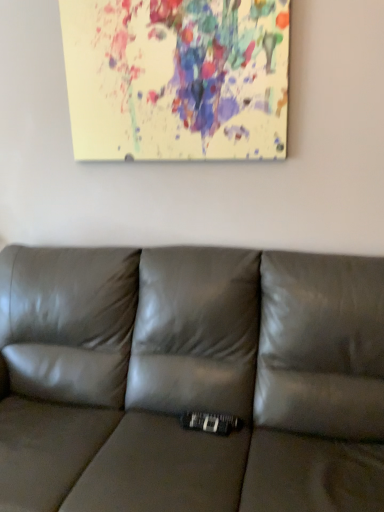
What do you see at coordinates (190, 380) in the screenshot?
I see `satin gray leather couch at center` at bounding box center [190, 380].

The image size is (384, 512). I want to click on satin gray leather couch at center, so (190, 380).

What is the approximate width of paint splatter canvas at upper center?

paint splatter canvas at upper center is 2.22 inches wide.

Locate an element on the screen. This screenshot has width=384, height=512. paint splatter canvas at upper center is located at coordinates coord(177,78).

What do you see at coordinates (177, 78) in the screenshot?
I see `paint splatter canvas at upper center` at bounding box center [177, 78].

Measure the distance between point (x=82, y=38) and camera.

The distance of point (x=82, y=38) from camera is 5.75 feet.

What are the coordinates of `satin gray leather couch at center` in the screenshot? It's located at (190, 380).

Which is more to the right, paint splatter canvas at upper center or satin gray leather couch at center?

From the viewer's perspective, paint splatter canvas at upper center appears more on the right side.

Which object is further away from the camera taking this photo, paint splatter canvas at upper center or satin gray leather couch at center?

paint splatter canvas at upper center is further from the camera.

Which point is more forward, (110, 55) or (45, 252)?

Positioned in front is point (110, 55).

From the image's perspective, which one is positioned higher, paint splatter canvas at upper center or satin gray leather couch at center?

paint splatter canvas at upper center is shown above in the image.

From a real-world perspective, is paint splatter canvas at upper center physically located above or below satin gray leather couch at center?

paint splatter canvas at upper center is above satin gray leather couch at center.

Looking at this image, is paint splatter canvas at upper center wider than satin gray leather couch at center?

Incorrect, the width of paint splatter canvas at upper center does not surpass that of satin gray leather couch at center.

Can you confirm if paint splatter canvas at upper center is shorter than satin gray leather couch at center?

Indeed, paint splatter canvas at upper center has a lesser height compared to satin gray leather couch at center.

Who is bigger, paint splatter canvas at upper center or satin gray leather couch at center?

satin gray leather couch at center.

Is satin gray leather couch at center surrounded by paint splatter canvas at upper center?

No, satin gray leather couch at center is not inside paint splatter canvas at upper center.

Are paint splatter canvas at upper center and satin gray leather couch at center making contact?

They are not placed beside each other.

Is paint splatter canvas at upper center positioned with its back to satin gray leather couch at center?

No, paint splatter canvas at upper center's orientation is not away from satin gray leather couch at center.

Find the location of `studio couch beneath the paint splatter canvas at upper center (from a real-world perspective)`. studio couch beneath the paint splatter canvas at upper center (from a real-world perspective) is located at coordinates (190, 380).

From the picture: Considering the relative positions of satin gray leather couch at center and paint splatter canvas at upper center in the image provided, is satin gray leather couch at center to the left or to the right of paint splatter canvas at upper center?

satin gray leather couch at center is positioned on paint splatter canvas at upper center's left side.

Relative to paint splatter canvas at upper center, is satin gray leather couch at center in front or behind?

satin gray leather couch at center is in front of paint splatter canvas at upper center.

Is point (127, 463) less distant than point (152, 87)?

Yes.

From the picture: From the image's perspective, which is below, satin gray leather couch at center or paint splatter canvas at upper center?

satin gray leather couch at center appears lower in the image.

From a real-world perspective, which object stands above the other?

paint splatter canvas at upper center is physically above.

Does satin gray leather couch at center have a greater width compared to paint splatter canvas at upper center?

Yes.

Can you confirm if satin gray leather couch at center is shorter than paint splatter canvas at upper center?

No, satin gray leather couch at center is not shorter than paint splatter canvas at upper center.

Can you confirm if satin gray leather couch at center is smaller than paint splatter canvas at upper center?

No, satin gray leather couch at center is not smaller than paint splatter canvas at upper center.

Looking at this image, is paint splatter canvas at upper center located within satin gray leather couch at center?

Definitely not — paint splatter canvas at upper center is not inside satin gray leather couch at center.

Is there a large distance between satin gray leather couch at center and paint splatter canvas at upper center?

No, satin gray leather couch at center is not far away from paint splatter canvas at upper center.

Is paint splatter canvas at upper center at the back of satin gray leather couch at center?

satin gray leather couch at center is not turned away from paint splatter canvas at upper center.

Measure the distance from satin gray leather couch at center to paint splatter canvas at upper center.

satin gray leather couch at center and paint splatter canvas at upper center are 31.16 inches apart.

Image resolution: width=384 pixels, height=512 pixels. In order to click on oil painting lying on the right of satin gray leather couch at center in this screenshot , I will do `click(177, 78)`.

Where is `oil painting behind the satin gray leather couch at center`? oil painting behind the satin gray leather couch at center is located at coordinates (177, 78).

The image size is (384, 512). Find the location of `studio couch that is on the left side of paint splatter canvas at upper center`. studio couch that is on the left side of paint splatter canvas at upper center is located at coordinates (190, 380).